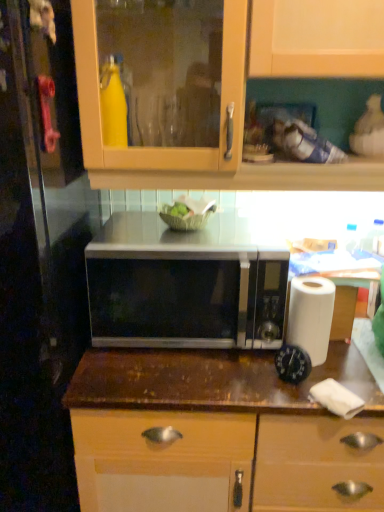
Question: Are brown wood countertop at center and satin silver microwave at center making contact?

Choices:
 (A) yes
 (B) no

Answer: (B)

Question: Is brown wood countertop at center outside satin silver microwave at center?

Choices:
 (A) no
 (B) yes

Answer: (B)

Question: Is brown wood countertop at center oriented away from satin silver microwave at center?

Choices:
 (A) yes
 (B) no

Answer: (B)

Question: Can you confirm if brown wood countertop at center is positioned to the left of satin silver microwave at center?

Choices:
 (A) yes
 (B) no

Answer: (B)

Question: From the image's perspective, would you say brown wood countertop at center is shown under satin silver microwave at center?

Choices:
 (A) yes
 (B) no

Answer: (A)

Question: Does brown wood countertop at center have a lesser height compared to satin silver microwave at center?

Choices:
 (A) no
 (B) yes

Answer: (A)

Question: Is transparent glass door at left at the left side of white paper at right?

Choices:
 (A) yes
 (B) no

Answer: (A)

Question: Is transparent glass door at left bigger than white paper at right?

Choices:
 (A) yes
 (B) no

Answer: (A)

Question: From a real-world perspective, is transparent glass door at left beneath white paper at right?

Choices:
 (A) no
 (B) yes

Answer: (B)

Question: Does transparent glass door at left appear on the right side of white paper at right?

Choices:
 (A) yes
 (B) no

Answer: (B)

Question: Is white paper at right inside transparent glass door at left?

Choices:
 (A) yes
 (B) no

Answer: (B)

Question: Is transparent glass door at left touching white paper at right?

Choices:
 (A) no
 (B) yes

Answer: (A)

Question: Is satin silver microwave at center taller than white paper towel at lower right?

Choices:
 (A) yes
 (B) no

Answer: (A)